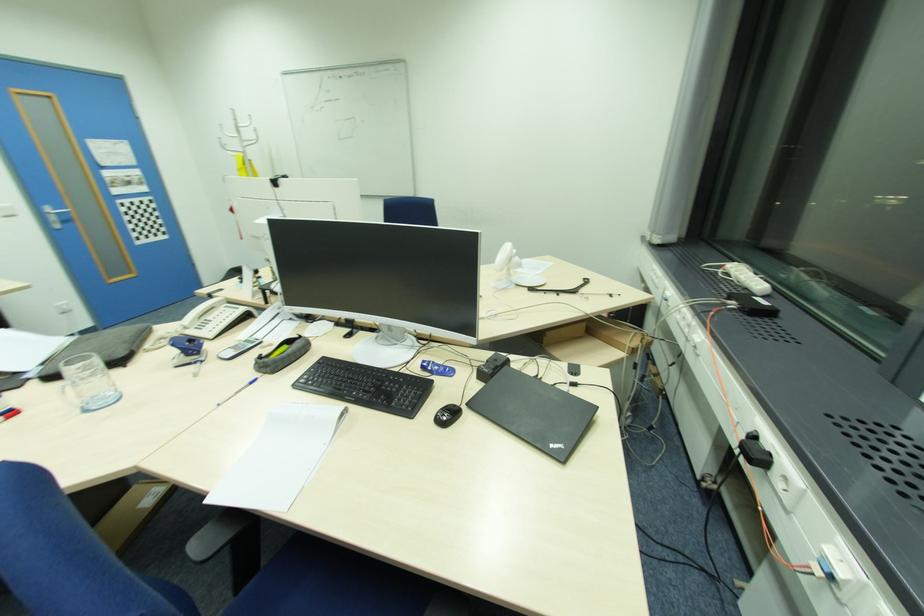
Locate an element on the screen. This screenshot has height=616, width=924. glass mug handle is located at coordinates (69, 398).